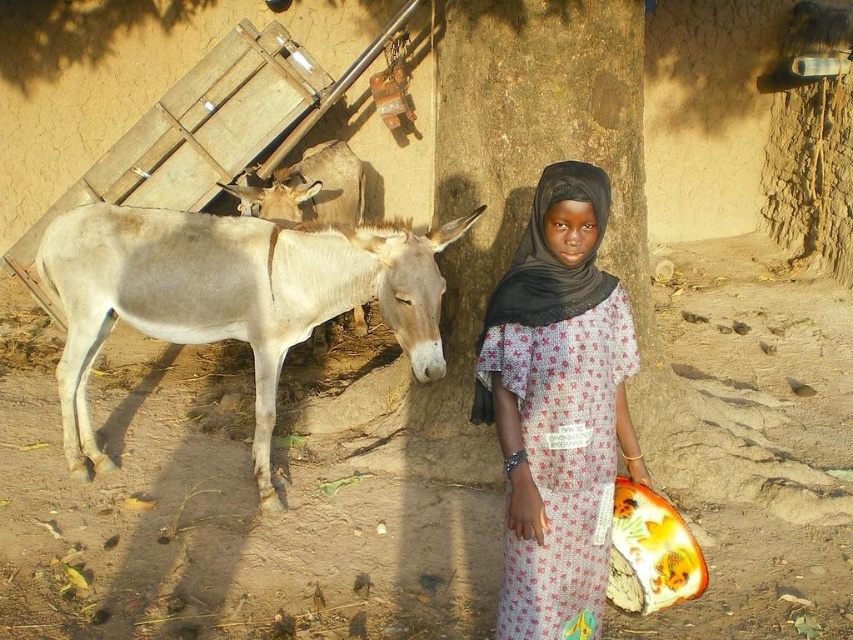
You are a traveler who needs to cross the brown dirt field at center. There is a light gray smooth mule at left nearby. Can you safely walk across the field without stepping on the mule?

The brown dirt field at center has a smaller size compared to light gray smooth mule at left, meaning the mule is larger and might occupy more space. Therefore, you should be cautious to avoid stepping on the mule while crossing the field.

You are a photographer trying to capture the light gray smooth mule at left and the printed cotton dress at center in a single frame. Based on their positions, which object is closer to the left edge of the photo?

The light gray smooth mule at left is positioned on the left side of the printed cotton dress at center, so it is closer to the left edge of the photo.

You are a photographer trying to capture the light gray smooth mule at left and the brown dirt field at center in the same shot. Which one should you focus on first to ensure both are in frame?

You should focus on the light gray smooth mule at left first because it is closer to you than the brown dirt field at center, which is further away.